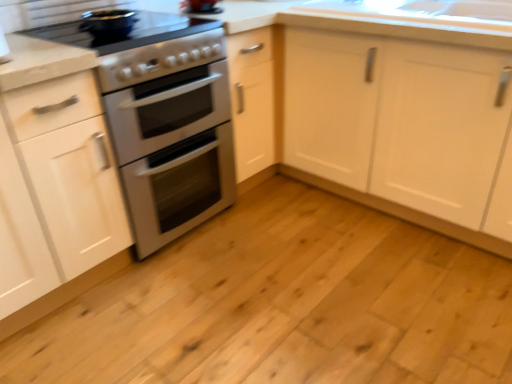
Question: Is natural wood floor at center to the left or to the right of white matte cabinet at center, which is the second cabinetry from left to right, in the image?

Choices:
 (A) right
 (B) left

Answer: (B)

Question: Considering the positions of natural wood floor at center and white matte cabinet at center, which is the second cabinetry from left to right, in the image, is natural wood floor at center bigger or smaller than white matte cabinet at center, which is the second cabinetry from left to right,?

Choices:
 (A) big
 (B) small

Answer: (B)

Question: Considering the real-world distances, which object is closest to the white matte cabinet at center, which is the second cabinetry from left to right?

Choices:
 (A) matte black pot at upper left, marked as the 1th appliance in a top-to-bottom arrangement
 (B) satin silver oven at center, which appears as the first appliance when ordered from the bottom
 (C) natural wood floor at center
 (D) white matte cabinet at left, acting as the second cabinetry starting from the right

Answer: (C)

Question: Which object is the farthest from the satin silver oven at center, which is the 2th appliance in top-to-bottom order?

Choices:
 (A) natural wood floor at center
 (B) white matte cabinet at left, acting as the second cabinetry starting from the right
 (C) matte black pot at upper left, which is counted as the 2th appliance, starting from the bottom
 (D) white matte cabinet at center, the 1th cabinetry from the right

Answer: (D)